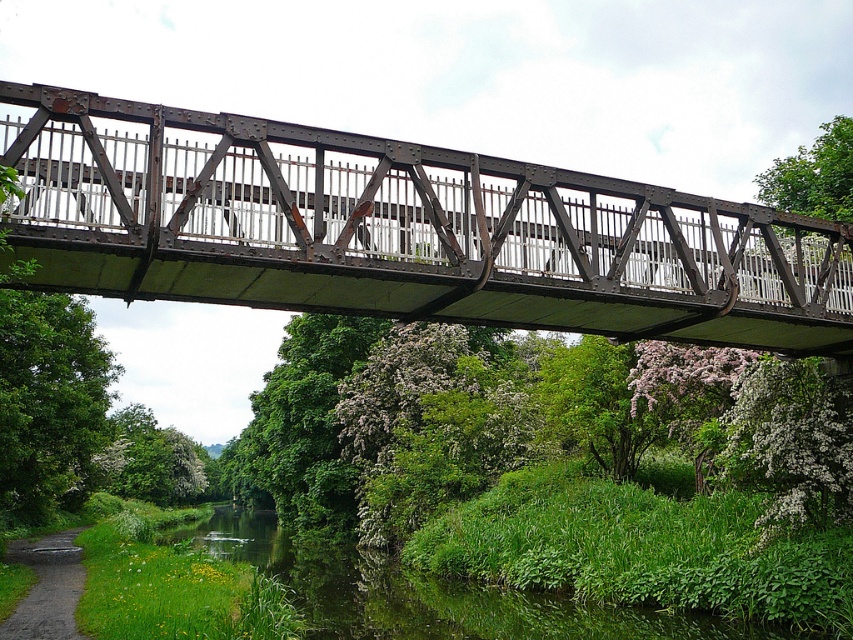
You are standing on the rusty metal bridge at center and want to reach the point marked at coordinates (399,230). Which direction should you move to reach that point?

The point at coordinates (399,230) is located on the rusty metal bridge at center, so you are already standing on the point.

You are a pedestrian standing on the bank of the green leafy river at lower center and want to cross to the other side. The rusty metal bridge at center is your only option. Is the bridge positioned in a way that allows you to reach it directly from your current position?

The rusty metal bridge at center is to the right of green leafy river at lower center, so you can walk to the right along the riverbank to reach the bridge and cross.